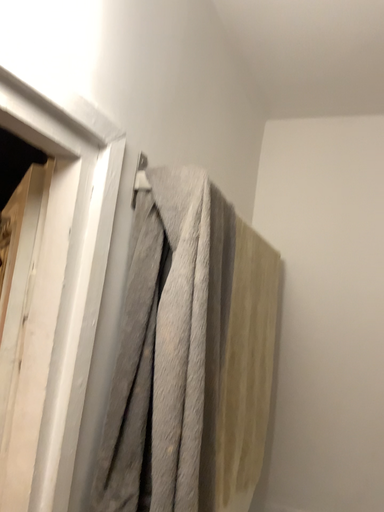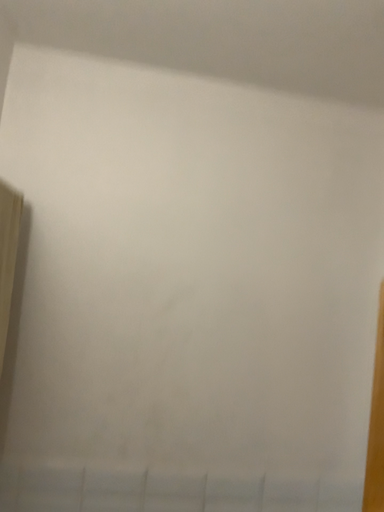
Question: Which way did the camera rotate in the video?

Choices:
 (A) rotated right
 (B) rotated left

Answer: (A)